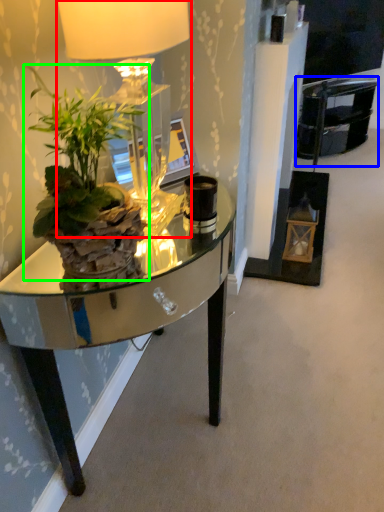
Question: Which is farther away from lamp (highlighted by a red box)? armchair (highlighted by a blue box) or houseplant (highlighted by a green box)?

Choices:
 (A) armchair
 (B) houseplant

Answer: (A)